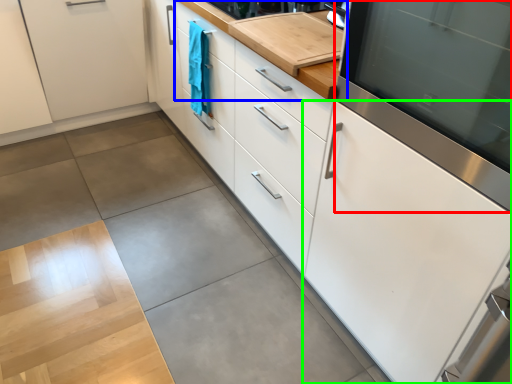
Question: Which is nearer to the home appliance (highlighted by a red box)? countertop (highlighted by a blue box) or cabinetry (highlighted by a green box).

Choices:
 (A) countertop
 (B) cabinetry

Answer: (B)